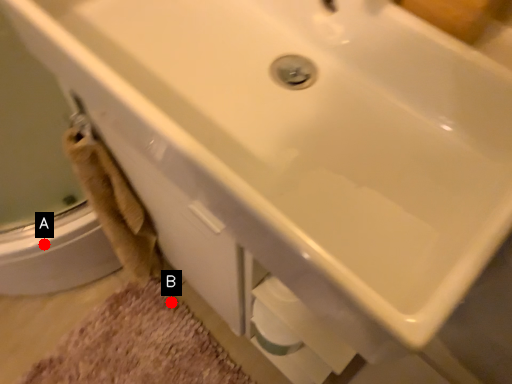
Question: Two points are circled on the image, labeled by A and B beside each circle. Among these points, which one is nearest to the camera?

Choices:
 (A) A is closer
 (B) B is closer

Answer: (A)